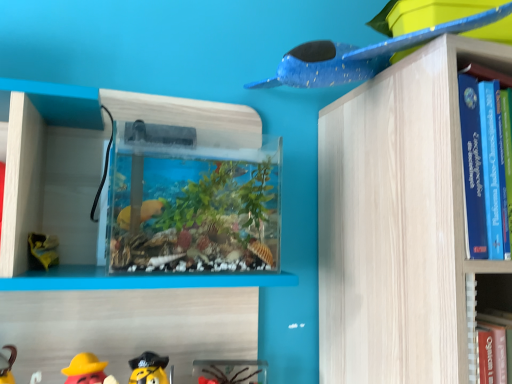
Question: Is blue speckled plastic airplane at upper right, the 1th toy positioned from the right, not within rubber duck at lower left, the 1th toy positioned from the left?

Choices:
 (A) no
 (B) yes

Answer: (B)

Question: Is the depth of blue speckled plastic airplane at upper right, acting as the third toy starting from the left, less than that of rubber duck at lower left, the 2th toy in the top-to-bottom sequence?

Choices:
 (A) no
 (B) yes

Answer: (B)

Question: Is blue speckled plastic airplane at upper right, which is the 3th toy in bottom-to-top order, bigger than rubber duck at lower left, which is counted as the 2th toy, starting from the bottom?

Choices:
 (A) no
 (B) yes

Answer: (B)

Question: Is blue speckled plastic airplane at upper right, which is the 3th toy in bottom-to-top order, wider than rubber duck at lower left, the 2th toy in the top-to-bottom sequence?

Choices:
 (A) no
 (B) yes

Answer: (B)

Question: Can you see blue speckled plastic airplane at upper right, the 1th toy when ordered from top to bottom, touching rubber duck at lower left, the 2th toy in the top-to-bottom sequence?

Choices:
 (A) no
 (B) yes

Answer: (A)

Question: Could rubber duck at lower left, the 3th toy positioned from the right, be considered to be inside blue speckled plastic airplane at upper right, which is the 3th toy in bottom-to-top order?

Choices:
 (A) no
 (B) yes

Answer: (A)

Question: From the image's perspective, is blue speckled plastic airplane at upper right, which is the 3th toy in bottom-to-top order, under translucent plastic toy at lower center, positioned as the second toy in right-to-left order?

Choices:
 (A) yes
 (B) no

Answer: (B)

Question: From a real-world perspective, is blue speckled plastic airplane at upper right, acting as the third toy starting from the left, on top of translucent plastic toy at lower center, positioned as the third toy in top-to-bottom order?

Choices:
 (A) yes
 (B) no

Answer: (A)

Question: Is translucent plastic toy at lower center, positioned as the third toy in top-to-bottom order, located within blue speckled plastic airplane at upper right, the 1th toy when ordered from top to bottom?

Choices:
 (A) no
 (B) yes

Answer: (A)

Question: Could you tell me if blue speckled plastic airplane at upper right, which is the 3th toy in bottom-to-top order, is turned towards translucent plastic toy at lower center, which is the 2th toy in left-to-right order?

Choices:
 (A) yes
 (B) no

Answer: (B)

Question: Is blue speckled plastic airplane at upper right, the 1th toy when ordered from top to bottom, located outside translucent plastic toy at lower center, positioned as the second toy in right-to-left order?

Choices:
 (A) no
 (B) yes

Answer: (B)

Question: From a real-world perspective, is blue speckled plastic airplane at upper right, the 1th toy when ordered from top to bottom, beneath translucent plastic toy at lower center, which is the 2th toy in left-to-right order?

Choices:
 (A) yes
 (B) no

Answer: (B)

Question: Are rubber duck at lower left, the 3th toy positioned from the right, and blue speckled plastic airplane at upper right, the 1th toy when ordered from top to bottom, beside each other?

Choices:
 (A) no
 (B) yes

Answer: (A)